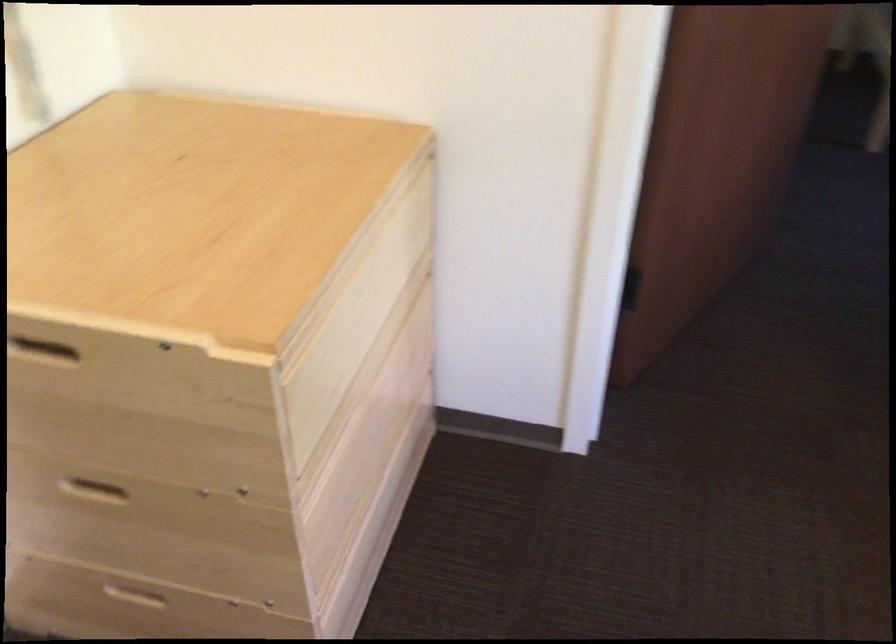
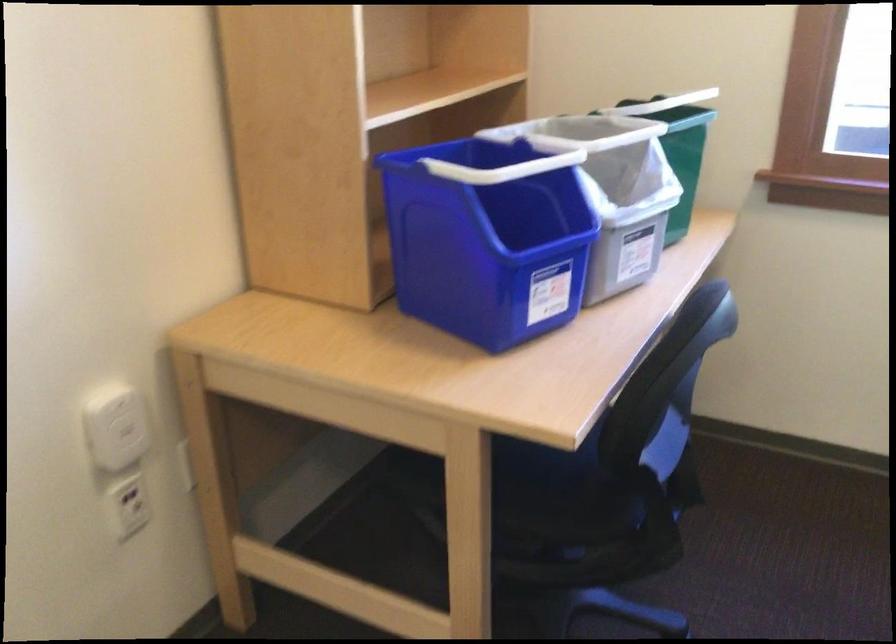
Question: Based on the continuous images, in which direction is the camera rotating? Reply with the corresponding letter.

Choices:
 (A) Left
 (B) Right
 (C) Up
 (D) Down

Answer: (B)